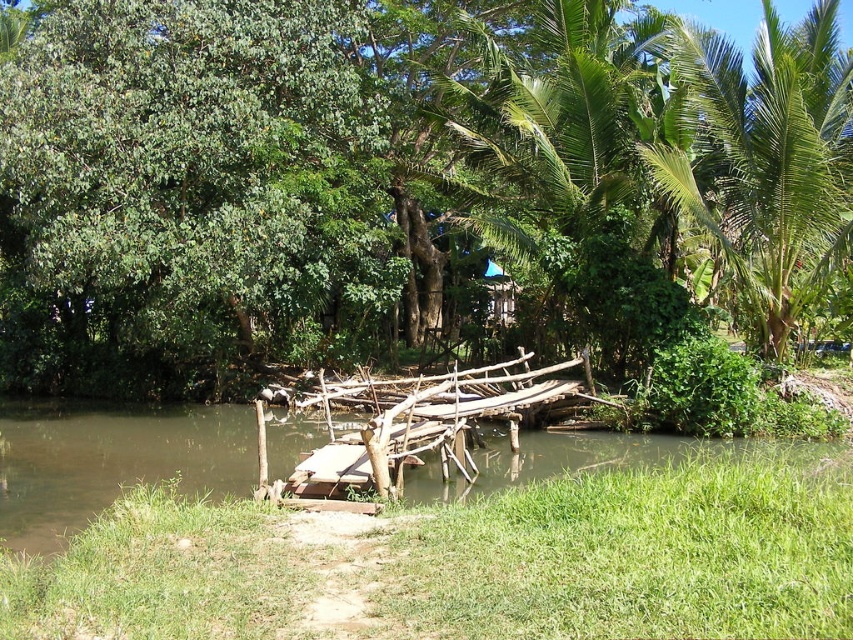
Question: Where is green leafy tree at upper left located in relation to green leafy palm tree at upper right in the image?

Choices:
 (A) below
 (B) above

Answer: (B)

Question: Estimate the real-world distances between objects in this image. Which object is closer to the green leafy tree at upper left?

Choices:
 (A) green leafy palm tree at upper right
 (B) green leafy tree at center

Answer: (B)

Question: Does green leafy tree at upper left appear on the left side of green leafy palm tree at upper right?

Choices:
 (A) no
 (B) yes

Answer: (B)

Question: Which point is farther to the camera?

Choices:
 (A) (248, 372)
 (B) (122, 282)

Answer: (A)

Question: Does green leafy tree at upper left have a smaller size compared to brown wooden bridge at center?

Choices:
 (A) yes
 (B) no

Answer: (B)

Question: Which object appears farthest from the camera in this image?

Choices:
 (A) green leafy tree at upper left
 (B) green leafy palm tree at upper right
 (C) brown wooden bridge at center
 (D) green leafy tree at center

Answer: (B)